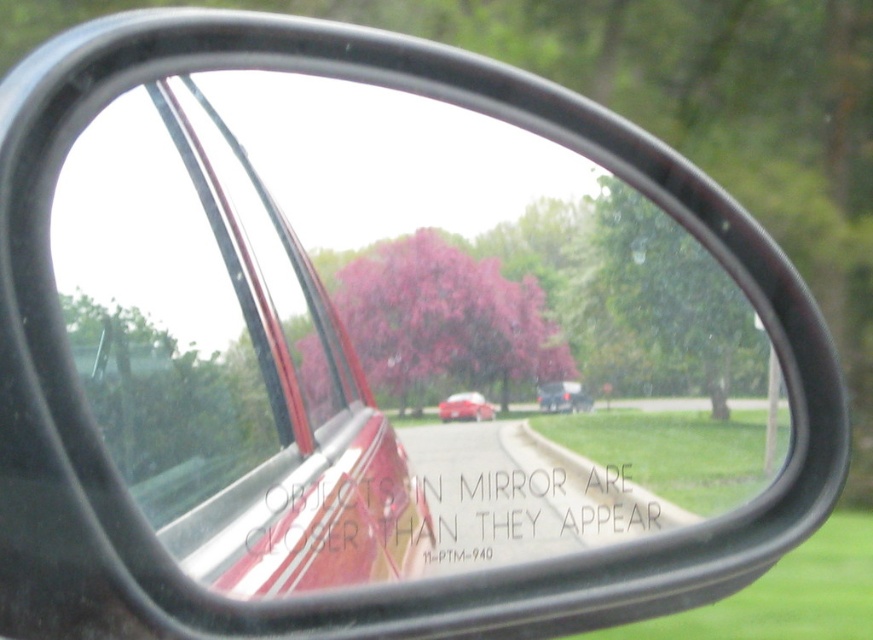
You are driving a car and notice two vehicles reflected in your side mirror. The scene shows a matte black sedan at center and a matte red car at center. According to the reflection, which vehicle is positioned to the right of the other?

The matte black sedan at center is to the right of the matte red car at center.

You are a driver checking your side mirror and notice the pink matte tree at center and the matte red car at center in the reflection. Which object appears higher in the mirror?

The pink matte tree at center appears higher in the mirror than the matte red car at center because it is located above it according to the reflection.

You are a passenger in a car and notice a white paper at center and a matte black sedan at center reflected in the side mirror. Which object is nearer to you as you look at the mirror?

The white paper at center is closer to the viewer than the matte black sedan at center, so the white paper at center appears nearer in the reflection.